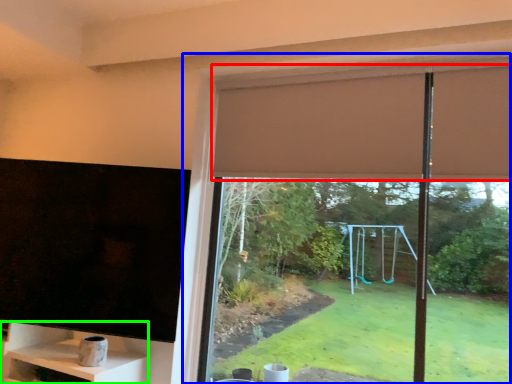
Question: Estimate the real-world distances between objects in this image. Which object is farther from curtain (highlighted by a red box), window (highlighted by a blue box) or shelf (highlighted by a green box)?

Choices:
 (A) window
 (B) shelf

Answer: (B)